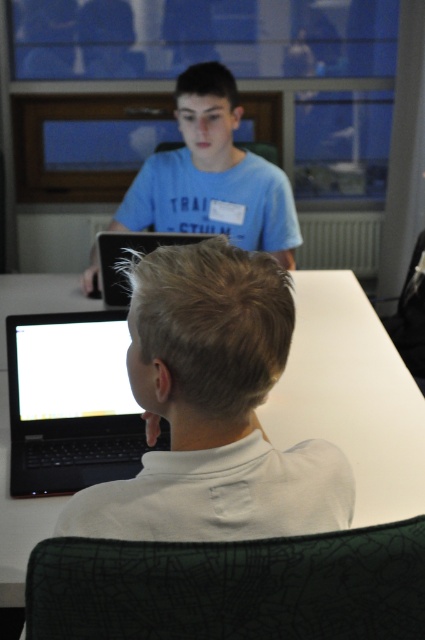
You are a photographer standing at a certain position. You want to take a photo of the white glossy table at center without any people blocking it. The minimum distance you can focus is 5 feet. Can you take the photo from your current position?

The white glossy table at center is 4.44 feet away from the camera. Since the minimum focusing distance is 5 feet, you cannot take the photo from your current position because the table is too close.

You are a photographer trying to capture a closeup of the blue cotton shirt at upper center without including the black glossy laptop at lower left in the frame. Based on their positions, is this possible?

The black glossy laptop at lower left is positioned on the left side of the blue cotton shirt at upper center, so it is possible to capture a closeup of the blue cotton shirt at upper center without including the black glossy laptop at lower left by focusing on the upper center area and avoiding the left side where the laptop is located.